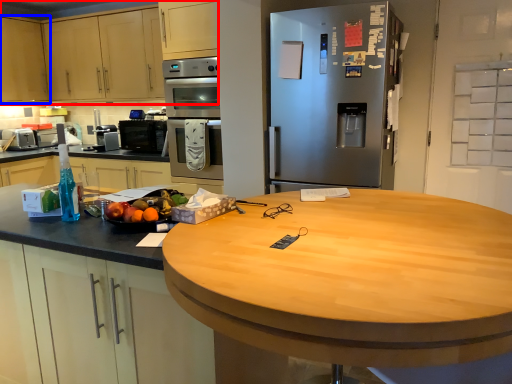
Question: Among these objects, which one is nearest to the camera, cabinetry (highlighted by a red box) or cabinetry (highlighted by a blue box)?

Choices:
 (A) cabinetry
 (B) cabinetry

Answer: (A)